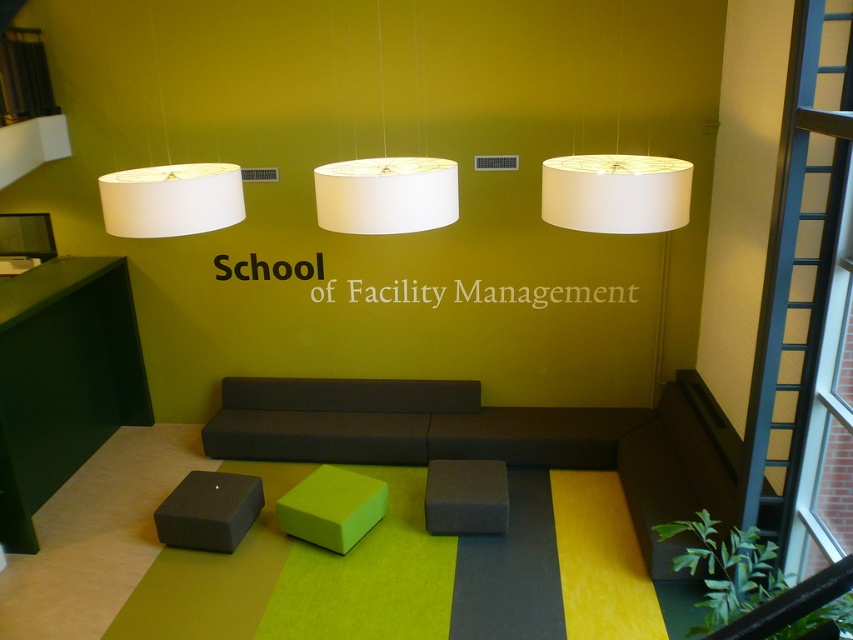
You are a visitor entering the School of Facility Management and want to sit on the matte gray stool at center. To avoid bumping your head, you need to know if there is enough space between the white matte lampshade at upper right and the stool. Can you confirm if the distance is sufficient?

The white matte lampshade at upper right is located above the matte gray stool at center, so there is enough vertical space between them to sit comfortably without hitting your head.